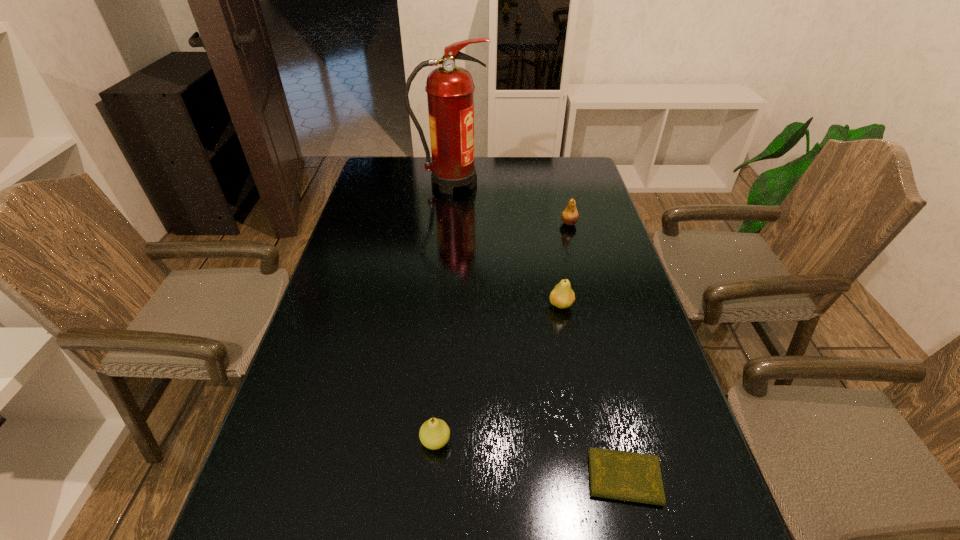
Where is `vacant space that satisfies the following two spatial constraints: 1. on the front-facing side of the fourth nearest object; 2. on the left side of the farthest object`? The image size is (960, 540). vacant space that satisfies the following two spatial constraints: 1. on the front-facing side of the fourth nearest object; 2. on the left side of the farthest object is located at coordinates (447, 224).

Identify the location of free space that satisfies the following two spatial constraints: 1. on the front-facing side of the tallest object; 2. on the left side of the rightmost pear. The width and height of the screenshot is (960, 540). (447, 224).

Where is `free point that satisfies the following two spatial constraints: 1. on the back side of the second pear from left to right; 2. on the front-facing side of the farthest object`? free point that satisfies the following two spatial constraints: 1. on the back side of the second pear from left to right; 2. on the front-facing side of the farthest object is located at coordinates (538, 183).